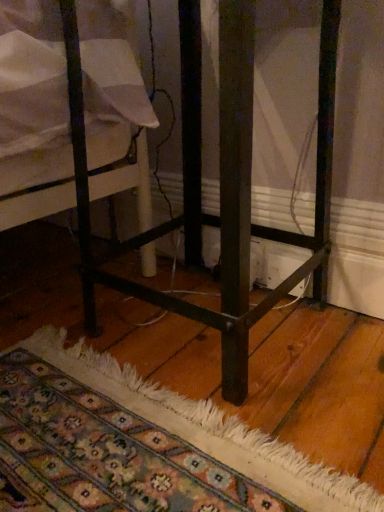
What do you see at coordinates (220, 181) in the screenshot?
I see `metallic black bed frame at center` at bounding box center [220, 181].

Find the location of `metallic black bed frame at center`. metallic black bed frame at center is located at coordinates (220, 181).

In order to face metallic black bed frame at center, should I rotate leftwards or rightwards?

You should look right and rotate roughly 1.887 degrees.

I want to click on metallic black bed frame at center, so click(220, 181).